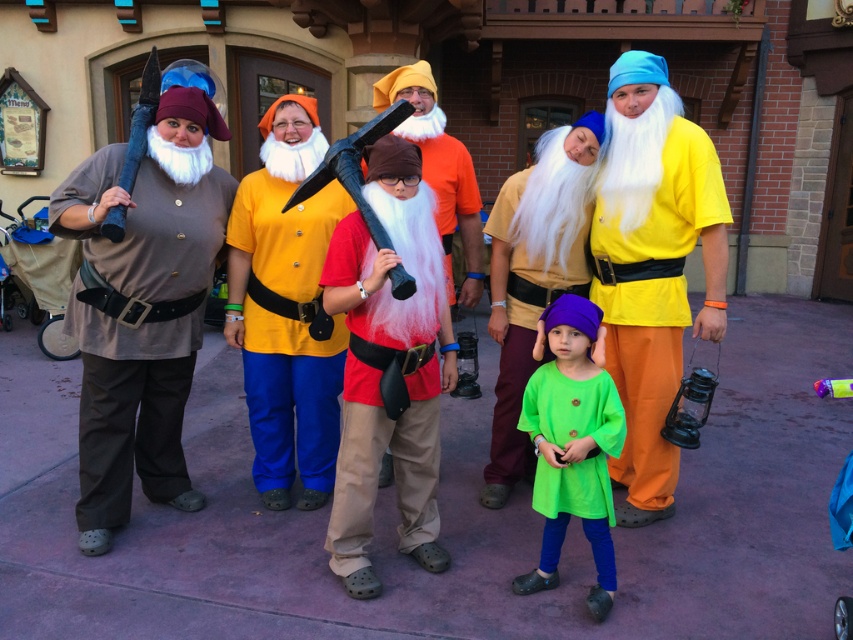
Can you confirm if green fabric dress at center is positioned to the left of purple felt hat at center?

Incorrect, green fabric dress at center is not on the left side of purple felt hat at center.

Does green fabric dress at center appear under purple felt hat at center?

Correct, green fabric dress at center is located below purple felt hat at center.

Is point (563, 349) more distant than point (518, 385)?

No, it is in front of (518, 385).

Locate an element on the screen. green fabric dress at center is located at coordinates tap(572, 445).

Who is higher up, matte brown shirt at center or brown fabric shirt at left?

matte brown shirt at center is above.

Which is in front, point (627, 348) or point (126, 316)?

Positioned in front is point (126, 316).

Where is `matte brown shirt at center`? This screenshot has height=640, width=853. matte brown shirt at center is located at coordinates (585, 320).

Does point (612, 573) lie behind point (312, 198)?

That is False.

Which is below, green fabric dress at center or yellow matte shirt at center?

Positioned lower is green fabric dress at center.

Where is `green fabric dress at center`? green fabric dress at center is located at coordinates (572, 445).